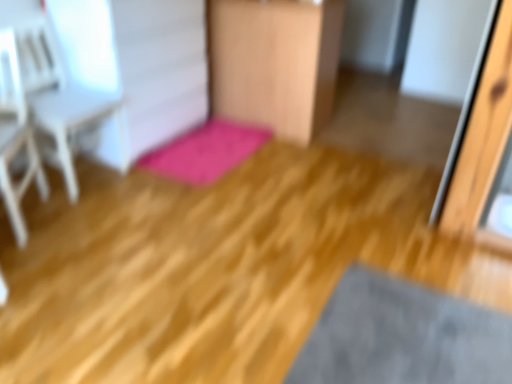
How much space does white wood armchair at upper left, placed as the first armchair when sorted from back to front, occupy horizontally?

19.87 inches.

This screenshot has width=512, height=384. Identify the location of pink plush bath mat at center. (205, 151).

Find the location of a particular element. The height and width of the screenshot is (384, 512). white wood armchair at upper left, placed as the first armchair when sorted from back to front is located at coordinates (79, 102).

From a real-world perspective, who is located lower, wooden chair at center or white wood armchair at left, which is the 2th armchair from back to front?

white wood armchair at left, which is the 2th armchair from back to front, from a real-world perspective.

Is white wood armchair at left, which is the 2th armchair from back to front, a part of wooden chair at center?

No, white wood armchair at left, which is the 2th armchair from back to front, is not surrounded by wooden chair at center.

Between wooden chair at center and white wood armchair at left, the 1th armchair from the front, which one has larger size?

wooden chair at center is bigger.

Measure the distance from wooden chair at center to white wood armchair at left, the 1th armchair from the front.

wooden chair at center and white wood armchair at left, the 1th armchair from the front, are 4.87 feet apart.

From the picture: Can you see white wood armchair at left, which is the 2th armchair from back to front, touching wooden chair at center?

There is a gap between white wood armchair at left, which is the 2th armchair from back to front, and wooden chair at center.

In the scene shown: Which object is thinner, white wood armchair at left, which is the 2th armchair from back to front, or wooden chair at center?

With smaller width is white wood armchair at left, which is the 2th armchair from back to front.

Is white wood armchair at left, which is the 2th armchair from back to front, facing towards wooden chair at center?

No.

Between white wood armchair at left, which is the 2th armchair from back to front, and wooden chair at center, which one has smaller size?

Smaller between the two is white wood armchair at left, which is the 2th armchair from back to front.

Can you confirm if pink plush bath mat at center is shorter than white wood armchair at left, which is the 2th armchair from back to front?

Correct, pink plush bath mat at center is not as tall as white wood armchair at left, which is the 2th armchair from back to front.

Which point is more forward, (x=194, y=159) or (x=13, y=191)?

The point (x=13, y=191) is closer.

Which object is positioned more to the right, pink plush bath mat at center or white wood armchair at left, which is the 2th armchair from back to front?

Positioned to the right is pink plush bath mat at center.

Locate an element on the screen. The width and height of the screenshot is (512, 384). bath mat above the white wood armchair at left, which is the 2th armchair from back to front (from the image's perspective) is located at coordinates (205, 151).

From the pink plush bath mat at center, count the 1st armchair to the left and point to it. Please provide its 2D coordinates.

[(79, 102)]

From their relative heights in the image, would you say white wood armchair at upper left, placed as the first armchair when sorted from back to front, is taller or shorter than pink plush bath mat at center?

Clearly, white wood armchair at upper left, placed as the first armchair when sorted from back to front, is taller compared to pink plush bath mat at center.

From the image's perspective, between white wood armchair at upper left, which is the second armchair from front to back, and pink plush bath mat at center, which one is located above?

white wood armchair at upper left, which is the second armchair from front to back, is shown above in the image.

Considering the points (60, 70) and (213, 138), which point is in front, point (60, 70) or point (213, 138)?

Positioned in front is point (60, 70).

Between white wood armchair at upper left, which is the second armchair from front to back, and white wood armchair at left, the 1th armchair from the front, which one has smaller width?

white wood armchair at upper left, which is the second armchair from front to back.

Based on the photo, can white wood armchair at left, the 1th armchair from the front, be found inside white wood armchair at upper left, which is the second armchair from front to back?

No, white wood armchair at upper left, which is the second armchair from front to back, does not contain white wood armchair at left, the 1th armchair from the front.

How distant is white wood armchair at upper left, placed as the first armchair when sorted from back to front, from white wood armchair at left, which is the 2th armchair from back to front?

8.84 inches.

Considering the relative positions of wooden chair at center and white wood armchair at upper left, which is the second armchair from front to back, in the image provided, is wooden chair at center to the left of white wood armchair at upper left, which is the second armchair from front to back, from the viewer's perspective?

Incorrect, wooden chair at center is not on the left side of white wood armchair at upper left, which is the second armchair from front to back.

Considering the relative sizes of wooden chair at center and white wood armchair at upper left, which is the second armchair from front to back, in the image provided, is wooden chair at center wider than white wood armchair at upper left, which is the second armchair from front to back,?

Yes, wooden chair at center is wider than white wood armchair at upper left, which is the second armchair from front to back.

Looking at this image, is wooden chair at center touching white wood armchair at upper left, placed as the first armchair when sorted from back to front?

wooden chair at center and white wood armchair at upper left, placed as the first armchair when sorted from back to front, are clearly separated.

Is wooden chair at center behind white wood armchair at upper left, which is the second armchair from front to back?

Yes, wooden chair at center is further from the camera.

Visually, is wooden chair at center positioned to the left or to the right of pink plush bath mat at center?

wooden chair at center is positioned on pink plush bath mat at center's right side.

How distant is wooden chair at center from pink plush bath mat at center?

A distance of 18.92 inches exists between wooden chair at center and pink plush bath mat at center.

How many degrees apart are the facing directions of wooden chair at center and pink plush bath mat at center?

They differ by 3.14 degrees in their facing directions.

Are wooden chair at center and pink plush bath mat at center making contact?

No, wooden chair at center is not in contact with pink plush bath mat at center.

There is a white wood armchair at left, which is the 2th armchair from back to front. Where is `furniture above it (from a real-world perspective)`? Image resolution: width=512 pixels, height=384 pixels. furniture above it (from a real-world perspective) is located at coordinates (274, 62).

Image resolution: width=512 pixels, height=384 pixels. Find the location of `armchair that is the 2nd object directly below the wooden chair at center (from a real-world perspective)`. armchair that is the 2nd object directly below the wooden chair at center (from a real-world perspective) is located at coordinates (16, 137).

Estimate the real-world distances between objects in this image. Which object is further from white wood armchair at left, which is the 2th armchair from back to front, pink plush bath mat at center or wooden chair at center?

Based on the image, wooden chair at center appears to be further to white wood armchair at left, which is the 2th armchair from back to front.

Based on their spatial positions, is pink plush bath mat at center or white wood armchair at left, which is the 2th armchair from back to front, closer to white wood armchair at upper left, placed as the first armchair when sorted from back to front?

Among the two, white wood armchair at left, which is the 2th armchair from back to front, is located nearer to white wood armchair at upper left, placed as the first armchair when sorted from back to front.

Based on the photo, which object lies further to the anchor point white wood armchair at upper left, placed as the first armchair when sorted from back to front, white wood armchair at left, which is the 2th armchair from back to front, or pink plush bath mat at center?

pink plush bath mat at center is positioned further to the anchor white wood armchair at upper left, placed as the first armchair when sorted from back to front.

Considering their positions, is white wood armchair at left, which is the 2th armchair from back to front, positioned closer to pink plush bath mat at center than white wood armchair at upper left, placed as the first armchair when sorted from back to front?

The object closer to pink plush bath mat at center is white wood armchair at upper left, placed as the first armchair when sorted from back to front.

From the image, which object appears to be farther from pink plush bath mat at center, white wood armchair at left, the 1th armchair from the front, or wooden chair at center?

Among the two, white wood armchair at left, the 1th armchair from the front, is located further to pink plush bath mat at center.

Which object lies further to the anchor point white wood armchair at upper left, placed as the first armchair when sorted from back to front, pink plush bath mat at center or wooden chair at center?

wooden chair at center is positioned further to the anchor white wood armchair at upper left, placed as the first armchair when sorted from back to front.

In the scene shown: Considering their positions, is pink plush bath mat at center positioned closer to wooden chair at center than white wood armchair at upper left, placed as the first armchair when sorted from back to front?

Based on the image, pink plush bath mat at center appears to be nearer to wooden chair at center.

From the image, which object appears to be nearer to white wood armchair at upper left, which is the second armchair from front to back, wooden chair at center or white wood armchair at left, which is the 2th armchair from back to front?

Among the two, white wood armchair at left, which is the 2th armchair from back to front, is located nearer to white wood armchair at upper left, which is the second armchair from front to back.

I want to click on bath mat located between white wood armchair at upper left, placed as the first armchair when sorted from back to front, and wooden chair at center in the left-right direction, so click(x=205, y=151).

Locate an element on the screen. This screenshot has width=512, height=384. armchair situated between white wood armchair at left, the 1th armchair from the front, and wooden chair at center from left to right is located at coordinates (79, 102).

The width and height of the screenshot is (512, 384). I want to click on bath mat between white wood armchair at left, the 1th armchair from the front, and wooden chair at center, in the horizontal direction, so click(205, 151).

This screenshot has height=384, width=512. I want to click on armchair positioned between white wood armchair at left, which is the 2th armchair from back to front, and pink plush bath mat at center from near to far, so click(x=79, y=102).